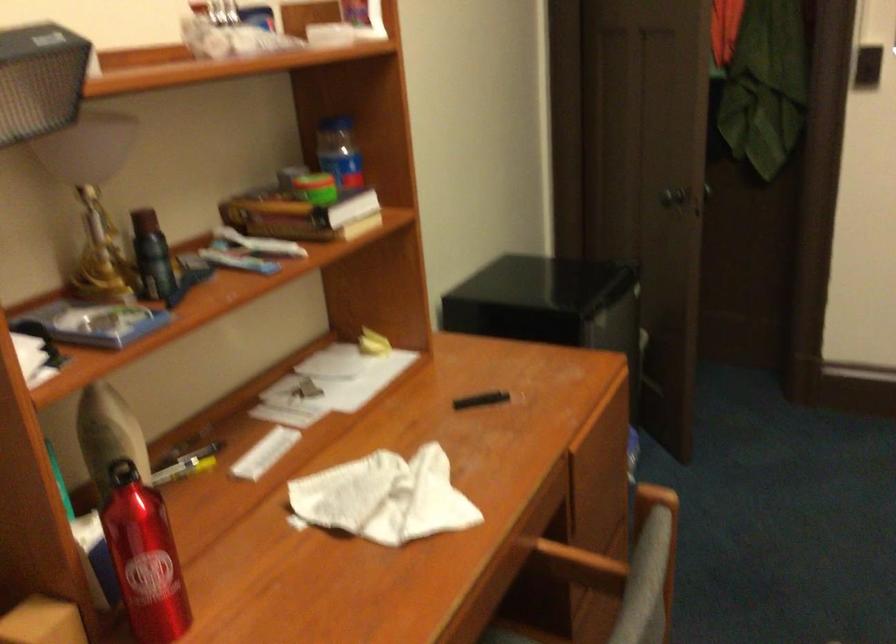
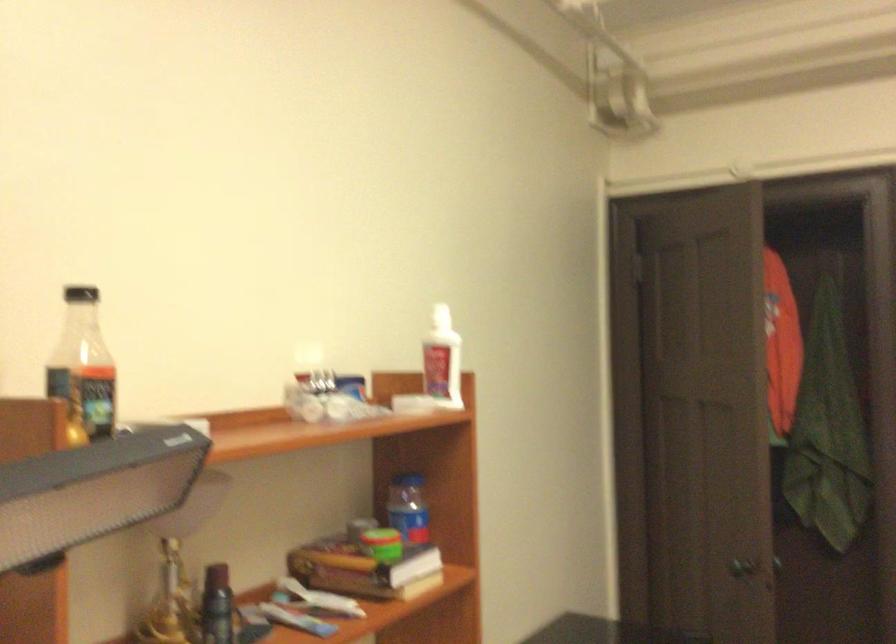
Question: The first image is from the beginning of the video and the second image is from the end. How did the camera likely rotate when shooting the video?

Choices:
 (A) Left
 (B) Right
 (C) Up
 (D) Down

Answer: (C)